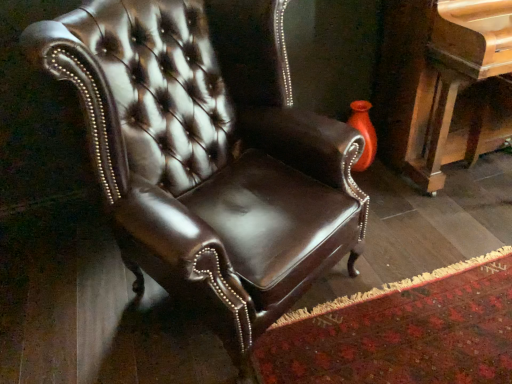
Locate an element on the screen. This screenshot has width=512, height=384. shiny brown leather chair at center is located at coordinates (209, 155).

What is the approximate height of shiny brown leather chair at center?

shiny brown leather chair at center is 3.48 feet in height.

Measure the distance between shiny brown leather chair at center and camera.

The distance of shiny brown leather chair at center from camera is 37.75 inches.

What do you see at coordinates (209, 155) in the screenshot? I see `shiny brown leather chair at center` at bounding box center [209, 155].

Looking at this image, measure the distance between point (314,255) and camera.

The depth of point (314,255) is 1.26 meters.

Describe the element at coordinates (453, 82) in the screenshot. Image resolution: width=512 pixels, height=384 pixels. I see `polished wood piano at right` at that location.

Find the location of a particular element. The image size is (512, 384). polished wood piano at right is located at coordinates (453, 82).

Where is `shiny brown leather chair at center`? This screenshot has height=384, width=512. shiny brown leather chair at center is located at coordinates (209, 155).

Considering the positions of objects shiny brown leather chair at center and polished wood piano at right in the image provided, who is more to the left, shiny brown leather chair at center or polished wood piano at right?

From the viewer's perspective, shiny brown leather chair at center appears more on the left side.

Relative to polished wood piano at right, is shiny brown leather chair at center in front or behind?

Clearly, shiny brown leather chair at center is in front of polished wood piano at right.

Does point (165, 248) come farther from viewer compared to point (489, 95)?

No, it is not.

From the image's perspective, relative to polished wood piano at right, is shiny brown leather chair at center above or below?

shiny brown leather chair at center is below polished wood piano at right.

From a real-world perspective, is shiny brown leather chair at center on top of polished wood piano at right?

Correct, in the physical world, shiny brown leather chair at center is higher than polished wood piano at right.

Between shiny brown leather chair at center and polished wood piano at right, which one has larger width?

shiny brown leather chair at center is wider.

Considering the sizes of objects shiny brown leather chair at center and polished wood piano at right in the image provided, who is taller, shiny brown leather chair at center or polished wood piano at right?

shiny brown leather chair at center is taller.

Is shiny brown leather chair at center bigger than polished wood piano at right?

Yes.

Is polished wood piano at right inside shiny brown leather chair at center?

No, polished wood piano at right is not a part of shiny brown leather chair at center.

Is shiny brown leather chair at center positioned far away from polished wood piano at right?

No, shiny brown leather chair at center is in close proximity to polished wood piano at right.

Is shiny brown leather chair at center looking in the opposite direction of polished wood piano at right?

That's not correct — shiny brown leather chair at center is not looking away from polished wood piano at right.

This screenshot has width=512, height=384. I want to click on piano behind the shiny brown leather chair at center, so click(453, 82).

Between polished wood piano at right and shiny brown leather chair at center, which one appears on the right side from the viewer's perspective?

polished wood piano at right is more to the right.

Between polished wood piano at right and shiny brown leather chair at center, which one is positioned in front?

shiny brown leather chair at center is closer to the camera.

Which is closer, (490, 71) or (314, 175)?

The point (314, 175) is closer to the camera.

From the image's perspective, which is below, polished wood piano at right or shiny brown leather chair at center?

From the image's view, shiny brown leather chair at center is below.

From a real-world perspective, which is physically above, polished wood piano at right or shiny brown leather chair at center?

shiny brown leather chair at center is physically above.

Considering the sizes of polished wood piano at right and shiny brown leather chair at center in the image, is polished wood piano at right wider or thinner than shiny brown leather chair at center?

Clearly, polished wood piano at right has less width compared to shiny brown leather chair at center.

Can you confirm if polished wood piano at right is taller than shiny brown leather chair at center?

Incorrect, the height of polished wood piano at right is not larger of that of shiny brown leather chair at center.

In terms of size, does polished wood piano at right appear bigger or smaller than shiny brown leather chair at center?

Considering their sizes, polished wood piano at right takes up less space than shiny brown leather chair at center.

Choose the correct answer: Is polished wood piano at right inside shiny brown leather chair at center or outside it?

polished wood piano at right is outside shiny brown leather chair at center.

From the picture: Is polished wood piano at right far from shiny brown leather chair at center?

That's not correct — polished wood piano at right is a little close to shiny brown leather chair at center.

Consider the image. Is polished wood piano at right oriented towards shiny brown leather chair at center?

No, polished wood piano at right is not facing towards shiny brown leather chair at center.

How different are the orientations of polished wood piano at right and shiny brown leather chair at center in degrees?

The angular difference between polished wood piano at right and shiny brown leather chair at center is 29.2 degrees.

How much distance is there between polished wood piano at right and shiny brown leather chair at center?

polished wood piano at right and shiny brown leather chair at center are 35.03 inches apart from each other.

Find the location of `piano below the shiny brown leather chair at center (from a real-world perspective)`. piano below the shiny brown leather chair at center (from a real-world perspective) is located at coordinates (453, 82).

You are a GUI agent. You are given a task and a screenshot of the screen. Output one action in this format:
    pyautogui.click(x=<x>, y=<y>)
    Task: Click on the piano to the right of shiny brown leather chair at center
    
    Given the screenshot: What is the action you would take?
    pyautogui.click(x=453, y=82)

The width and height of the screenshot is (512, 384). I want to click on chair in front of the polished wood piano at right, so click(x=209, y=155).